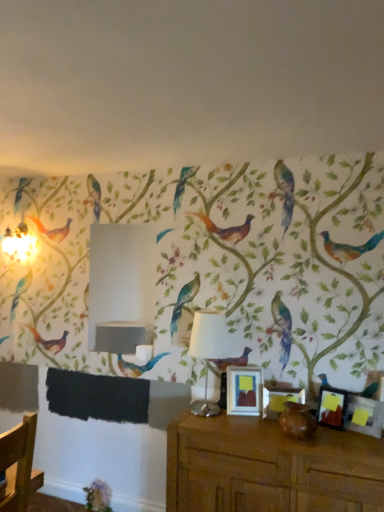
How much space does matte wooden picture frame at center, the second picture frame viewed from the left, occupy vertically?

matte wooden picture frame at center, the second picture frame viewed from the left, is 8.74 inches tall.

Describe the element at coordinates (244, 390) in the screenshot. I see `matte silver picture frame at center, which appears as the first picture frame when viewed from the left` at that location.

Identify the location of brown matte vase at lower center. Image resolution: width=384 pixels, height=512 pixels. (298, 420).

Where is `matte wooden picture frame at center, the second picture frame viewed from the left`? The image size is (384, 512). matte wooden picture frame at center, the second picture frame viewed from the left is located at coordinates (279, 398).

From the image's perspective, between matte wooden picture frame at center, which appears as the third picture frame when viewed from the right, and matte black picture frame at lower right, the 1th picture frame from the right, which one is located above?

matte wooden picture frame at center, which appears as the third picture frame when viewed from the right, appears higher in the image.

Can you confirm if matte wooden picture frame at center, the second picture frame viewed from the left, is shorter than matte black picture frame at lower right, the fourth picture frame in the left-to-right sequence?

Correct, matte wooden picture frame at center, the second picture frame viewed from the left, is not as tall as matte black picture frame at lower right, the fourth picture frame in the left-to-right sequence.

Which object is further away from the camera, matte wooden picture frame at center, which appears as the third picture frame when viewed from the right, or matte black picture frame at lower right, the 1th picture frame from the right?

matte wooden picture frame at center, which appears as the third picture frame when viewed from the right, is further from the camera.

Can you confirm if matte black picture frame at right, which ranks as the 2th picture frame in right-to-left order, is shorter than brown matte vase at lower center?

In fact, matte black picture frame at right, which ranks as the 2th picture frame in right-to-left order, may be taller than brown matte vase at lower center.

From a real-world perspective, which is physically below, matte black picture frame at right, placed as the third picture frame when sorted from left to right, or brown matte vase at lower center?

In real-world perspective, brown matte vase at lower center is lower.

Does matte black picture frame at right, placed as the third picture frame when sorted from left to right, contain brown matte vase at lower center?

No, brown matte vase at lower center is not surrounded by matte black picture frame at right, placed as the third picture frame when sorted from left to right.

Is matte black picture frame at right, which ranks as the 2th picture frame in right-to-left order, located within brown wooden table at lower right?

No, matte black picture frame at right, which ranks as the 2th picture frame in right-to-left order, is not a part of brown wooden table at lower right.

Considering the positions of point (196, 417) and point (340, 417), is point (196, 417) closer or farther from the camera than point (340, 417)?

Point (196, 417) is farther from the camera than point (340, 417).

Is brown wooden table at lower right aimed at matte black picture frame at right, which ranks as the 2th picture frame in right-to-left order?

No.

Is brown matte vase at lower center positioned with its back to matte wooden picture frame at center, which appears as the third picture frame when viewed from the right?

Correct, brown matte vase at lower center is looking away from matte wooden picture frame at center, which appears as the third picture frame when viewed from the right.

From a real-world perspective, is brown matte vase at lower center physically located above or below matte wooden picture frame at center, the second picture frame viewed from the left?

From a real-world perspective, brown matte vase at lower center is physically below matte wooden picture frame at center, the second picture frame viewed from the left.

What's the angular difference between brown matte vase at lower center and matte wooden picture frame at center, which appears as the third picture frame when viewed from the right,'s facing directions?

brown matte vase at lower center and matte wooden picture frame at center, which appears as the third picture frame when viewed from the right, are facing 6.62 degrees away from each other.

Image resolution: width=384 pixels, height=512 pixels. I want to click on picture frame that is the 2nd one when counting upward from the brown matte vase at lower center (from the image's perspective), so click(x=279, y=398).

In order to click on picture frame behind the white fabric lampshade at center in this screenshot , I will do `click(244, 390)`.

Considering the sizes of objects matte silver picture frame at center, arranged as the 4th picture frame when viewed from the right, and white fabric lampshade at center in the image provided, who is taller, matte silver picture frame at center, arranged as the 4th picture frame when viewed from the right, or white fabric lampshade at center?

Standing taller between the two is white fabric lampshade at center.

From a real-world perspective, does matte silver picture frame at center, which appears as the first picture frame when viewed from the left, stand above white fabric lampshade at center?

No.

Considering the sizes of matte silver picture frame at center, arranged as the 4th picture frame when viewed from the right, and white fabric lampshade at center in the image, is matte silver picture frame at center, arranged as the 4th picture frame when viewed from the right, wider or thinner than white fabric lampshade at center?

matte silver picture frame at center, arranged as the 4th picture frame when viewed from the right, is thinner than white fabric lampshade at center.

At what (x,y) coordinates should I click in order to perform the action: click on animal lying below the matte silver picture frame at center, arranged as the 4th picture frame when viewed from the right (from the image's perspective). Please return your answer as a coordinate pair (x, y). The width and height of the screenshot is (384, 512). Looking at the image, I should click on (298, 420).

Consider the image. Is the position of matte silver picture frame at center, arranged as the 4th picture frame when viewed from the right, less distant than that of brown matte vase at lower center?

No, matte silver picture frame at center, arranged as the 4th picture frame when viewed from the right, is behind brown matte vase at lower center.

How far apart are matte silver picture frame at center, which appears as the first picture frame when viewed from the left, and brown matte vase at lower center?

The distance of matte silver picture frame at center, which appears as the first picture frame when viewed from the left, from brown matte vase at lower center is 10.53 inches.

Consider the image. Who is smaller, matte silver picture frame at center, arranged as the 4th picture frame when viewed from the right, or brown matte vase at lower center?

brown matte vase at lower center is smaller.

Could you tell me if matte black picture frame at right, which ranks as the 2th picture frame in right-to-left order, is facing white fabric lampshade at center?

No, matte black picture frame at right, which ranks as the 2th picture frame in right-to-left order, is not oriented towards white fabric lampshade at center.

In the image, is matte black picture frame at right, placed as the third picture frame when sorted from left to right, positioned in front of or behind white fabric lampshade at center?

matte black picture frame at right, placed as the third picture frame when sorted from left to right, is in front of white fabric lampshade at center.

Does matte black picture frame at right, placed as the third picture frame when sorted from left to right, have a lesser width compared to white fabric lampshade at center?

Indeed, matte black picture frame at right, placed as the third picture frame when sorted from left to right, has a lesser width compared to white fabric lampshade at center.

You are a GUI agent. You are given a task and a screenshot of the screen. Output one action in this format:
    pyautogui.click(x=<x>, y=<y>)
    Task: Click on the table lamp above the matte black picture frame at right, placed as the third picture frame when sorted from left to right (from the image's perspective)
    
    Given the screenshot: What is the action you would take?
    pyautogui.click(x=209, y=350)

Locate an element on the screen. The height and width of the screenshot is (512, 384). the 1st picture frame above the matte black picture frame at lower right, the fourth picture frame in the left-to-right sequence (from a real-world perspective) is located at coordinates (279, 398).

Find the location of `animal on the left of matte black picture frame at right, which ranks as the 2th picture frame in right-to-left order`. animal on the left of matte black picture frame at right, which ranks as the 2th picture frame in right-to-left order is located at coordinates (298, 420).

Looking at the image, which one is located closer to matte black picture frame at right, placed as the third picture frame when sorted from left to right, white fabric lampshade at center or matte black picture frame at lower right, the 1th picture frame from the right?

matte black picture frame at lower right, the 1th picture frame from the right, lies closer to matte black picture frame at right, placed as the third picture frame when sorted from left to right, than the other object.

From the image, which object appears to be nearer to matte silver picture frame at center, which appears as the first picture frame when viewed from the left, matte black picture frame at right, placed as the third picture frame when sorted from left to right, or brown wooden table at lower right?

brown wooden table at lower right.

Which object lies nearer to the anchor point matte black picture frame at lower right, the 1th picture frame from the right, brown matte vase at lower center or matte black picture frame at right, placed as the third picture frame when sorted from left to right?

matte black picture frame at right, placed as the third picture frame when sorted from left to right, lies closer to matte black picture frame at lower right, the 1th picture frame from the right, than the other object.

From the image, which object appears to be farther from brown matte vase at lower center, matte black picture frame at right, placed as the third picture frame when sorted from left to right, or matte black picture frame at lower right, the fourth picture frame in the left-to-right sequence?

matte black picture frame at lower right, the fourth picture frame in the left-to-right sequence, is further to brown matte vase at lower center.

Based on their spatial positions, is matte black picture frame at right, placed as the third picture frame when sorted from left to right, or white fabric lampshade at center further from matte silver picture frame at center, which appears as the first picture frame when viewed from the left?

matte black picture frame at right, placed as the third picture frame when sorted from left to right, is positioned further to the anchor matte silver picture frame at center, which appears as the first picture frame when viewed from the left.

From the picture: When comparing their distances from matte black picture frame at lower right, the fourth picture frame in the left-to-right sequence, does white fabric lampshade at center or matte black picture frame at right, which ranks as the 2th picture frame in right-to-left order, seem closer?

matte black picture frame at right, which ranks as the 2th picture frame in right-to-left order, is positioned closer to the anchor matte black picture frame at lower right, the fourth picture frame in the left-to-right sequence.

From the picture: Looking at the image, which one is located further to white fabric lampshade at center, brown matte vase at lower center or matte wooden picture frame at center, which appears as the third picture frame when viewed from the right?

Among the two, brown matte vase at lower center is located further to white fabric lampshade at center.

Looking at the image, which one is located closer to brown matte vase at lower center, matte black picture frame at lower right, the 1th picture frame from the right, or matte silver picture frame at center, which appears as the first picture frame when viewed from the left?

Based on the image, matte silver picture frame at center, which appears as the first picture frame when viewed from the left, appears to be nearer to brown matte vase at lower center.

I want to click on picture frame that lies between matte wooden picture frame at center, which appears as the third picture frame when viewed from the right, and brown wooden table at lower right from top to bottom, so click(x=365, y=415).

Where is `table situated between matte silver picture frame at center, which appears as the first picture frame when viewed from the left, and matte black picture frame at lower right, the 1th picture frame from the right, from left to right`? table situated between matte silver picture frame at center, which appears as the first picture frame when viewed from the left, and matte black picture frame at lower right, the 1th picture frame from the right, from left to right is located at coordinates (269, 468).

Image resolution: width=384 pixels, height=512 pixels. Find the location of `animal between white fabric lampshade at center and matte black picture frame at right, placed as the third picture frame when sorted from left to right, in the horizontal direction`. animal between white fabric lampshade at center and matte black picture frame at right, placed as the third picture frame when sorted from left to right, in the horizontal direction is located at coordinates (298, 420).

Locate an element on the screen. This screenshot has width=384, height=512. animal that lies between white fabric lampshade at center and brown wooden table at lower right from top to bottom is located at coordinates [298, 420].